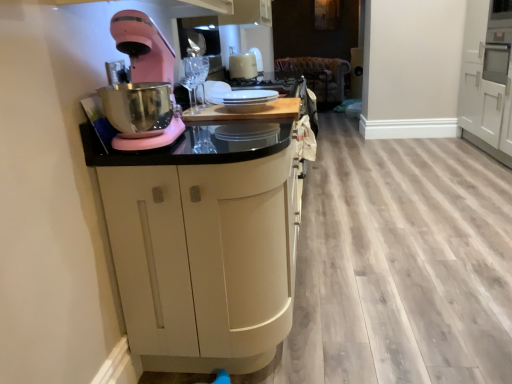
Question: Is white glossy kettle at upper center inside the boundaries of pink matte stand mixer at left, or outside?

Choices:
 (A) outside
 (B) inside

Answer: (A)

Question: From a real-world perspective, is white glossy kettle at upper center physically located above or below pink matte stand mixer at left?

Choices:
 (A) above
 (B) below

Answer: (B)

Question: Estimate the real-world distances between objects in this image. Which object is farther from the white matte cabinet at right, marked as the first cabinetry in a right-to-left arrangement?

Choices:
 (A) white glossy plates at center
 (B) pink matte stand mixer at left
 (C) white glossy kettle at upper center
 (D) wooden at center
 (E) matte black cabinet at center, which is the 1th cabinetry in left-to-right order

Answer: (B)

Question: Estimate the real-world distances between objects in this image. Which object is farther from the pink matte stand mixer at left?

Choices:
 (A) matte black cabinet at center, the second cabinetry positioned from the right
 (B) wooden at center
 (C) white glossy kettle at upper center
 (D) white matte cabinet at right, marked as the first cabinetry in a right-to-left arrangement
 (E) white glossy plates at center

Answer: (D)